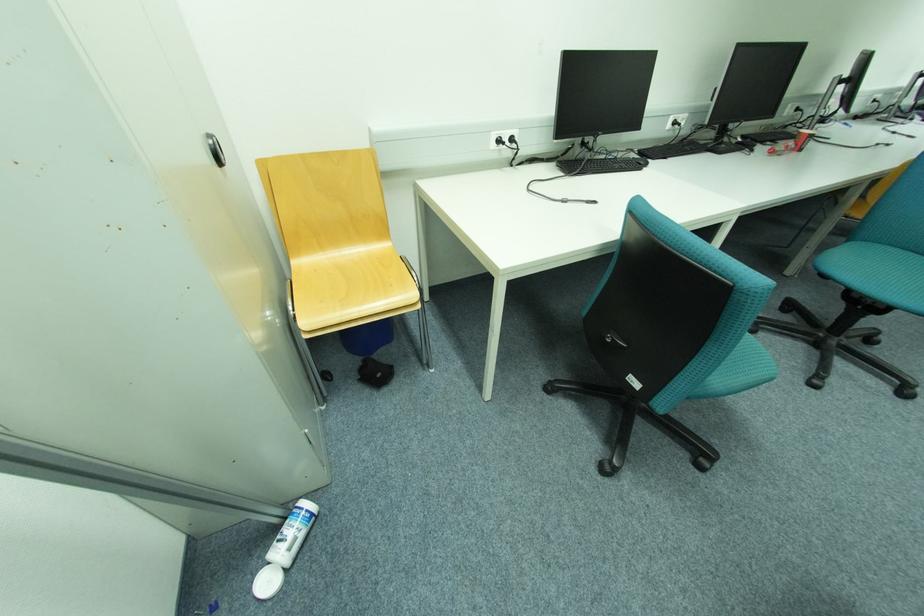
This screenshot has width=924, height=616. What do you see at coordinates (214, 150) in the screenshot?
I see `a recessed cabinet handle` at bounding box center [214, 150].